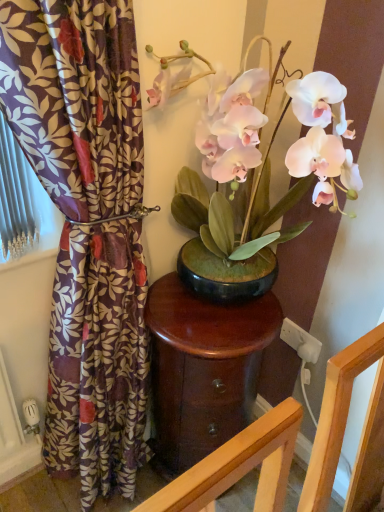
Question: Is purple floral fabric at left wider or thinner than white matte orchid at center?

Choices:
 (A) wide
 (B) thin

Answer: (B)

Question: Considering the positions of purple floral fabric at left and white matte orchid at center in the image, is purple floral fabric at left bigger or smaller than white matte orchid at center?

Choices:
 (A) small
 (B) big

Answer: (B)

Question: Estimate the real-world distances between objects in this image. Which object is farther from the white matte orchid at center?

Choices:
 (A) glossy wood table at center
 (B) purple floral fabric at left

Answer: (B)

Question: Estimate the real-world distances between objects in this image. Which object is farther from the white matte orchid at center?

Choices:
 (A) purple floral fabric at left
 (B) glossy wood table at center

Answer: (A)